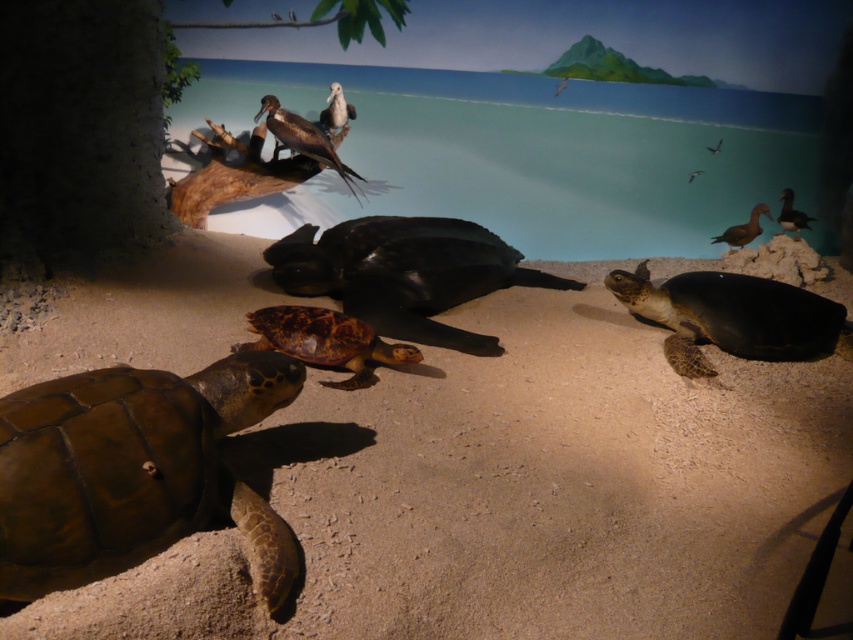
Question: Can you confirm if shiny black tortoise at center is wider than brown textured shell at right?

Choices:
 (A) yes
 (B) no

Answer: (A)

Question: Considering the relative positions of brown sandy beach at center and smooth dark green tortoise at right in the image provided, where is brown sandy beach at center located with respect to smooth dark green tortoise at right?

Choices:
 (A) right
 (B) left

Answer: (B)

Question: Which of the following is the farthest from the observer?

Choices:
 (A) (27, 561)
 (B) (318, 339)
 (C) (740, 225)
 (D) (410, 241)

Answer: (C)

Question: Based on their relative distances, which object is farther from the shiny black tortoise at center?

Choices:
 (A) brown matte tortoise at lower left
 (B) brown textured shell at right

Answer: (A)

Question: Does brown matte tortoise at lower left have a greater width compared to smooth brown tortoise at right?

Choices:
 (A) yes
 (B) no

Answer: (A)

Question: Which object is positioned closest to the shiny black tortoise at center?

Choices:
 (A) brown sandy beach at center
 (B) brown matte/tough shell at center
 (C) smooth dark green tortoise at right

Answer: (A)